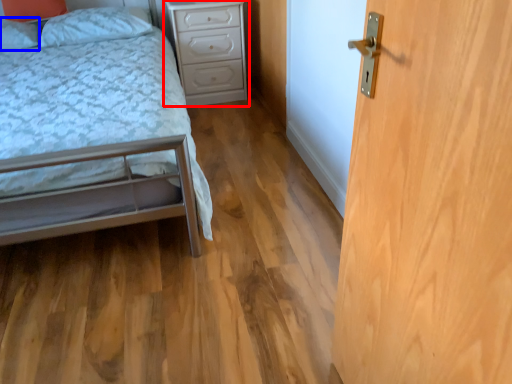
Question: Which of the following is the farthest to the observer, nightstand (highlighted by a red box) or pillow (highlighted by a blue box)?

Choices:
 (A) nightstand
 (B) pillow

Answer: (A)